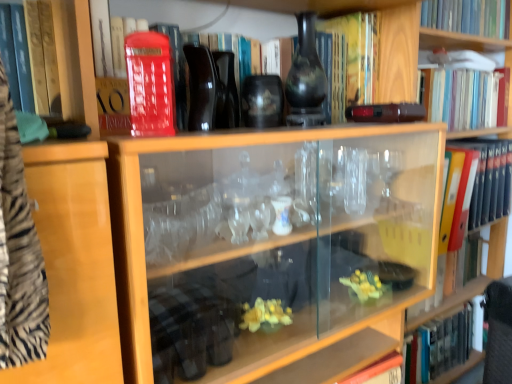
Question: From a real-world perspective, is matte red book at upper center, acting as the 4th book starting from the top, below matte red phone box at upper left?

Choices:
 (A) yes
 (B) no

Answer: (B)

Question: Is matte red book at upper center, acting as the 4th book starting from the top, not within matte red phone box at upper left?

Choices:
 (A) yes
 (B) no

Answer: (A)

Question: Is matte red book at upper center, acting as the 4th book starting from the top, to the right of matte red phone box at upper left from the viewer's perspective?

Choices:
 (A) no
 (B) yes

Answer: (B)

Question: Does matte red book at upper center, which is counted as the third book, starting from the bottom, have a smaller size compared to matte red phone box at upper left?

Choices:
 (A) no
 (B) yes

Answer: (A)

Question: Does matte red book at upper center, acting as the 4th book starting from the top, appear on the left side of matte red phone box at upper left?

Choices:
 (A) no
 (B) yes

Answer: (A)

Question: From the image's perspective, relative to matte black vase at upper center, is matte red book at upper center, which is counted as the third book, starting from the bottom, above or below?

Choices:
 (A) below
 (B) above

Answer: (A)

Question: Considering the positions of matte red book at upper center, acting as the 4th book starting from the top, and matte black vase at upper center in the image, is matte red book at upper center, acting as the 4th book starting from the top, bigger or smaller than matte black vase at upper center?

Choices:
 (A) big
 (B) small

Answer: (A)

Question: From a real-world perspective, is matte red book at upper center, which is counted as the third book, starting from the bottom, above or below matte black vase at upper center?

Choices:
 (A) above
 (B) below

Answer: (B)

Question: Looking at their shapes, would you say matte red book at upper center, acting as the 4th book starting from the top, is wider or thinner than matte black vase at upper center?

Choices:
 (A) thin
 (B) wide

Answer: (B)

Question: Is hardcover book at lower right, which is the sixth book from top to bottom, inside or outside of hardcover book at upper right, acting as the fifth book starting from the bottom?

Choices:
 (A) inside
 (B) outside

Answer: (B)

Question: Considering the positions of hardcover book at lower right, placed as the first book when sorted from bottom to top, and hardcover book at upper right, acting as the fifth book starting from the bottom, in the image, is hardcover book at lower right, placed as the first book when sorted from bottom to top, taller or shorter than hardcover book at upper right, acting as the fifth book starting from the bottom,?

Choices:
 (A) tall
 (B) short

Answer: (A)

Question: In the image, is hardcover book at lower right, which is the sixth book from top to bottom, on the left side or the right side of hardcover book at upper right, acting as the fifth book starting from the bottom?

Choices:
 (A) left
 (B) right

Answer: (B)

Question: From the image's perspective, is hardcover book at lower right, placed as the first book when sorted from bottom to top, above or below hardcover book at upper right, acting as the fifth book starting from the bottom?

Choices:
 (A) above
 (B) below

Answer: (B)

Question: Considering the positions of wooden bookshelf at upper right and matte black vase at upper center in the image, is wooden bookshelf at upper right wider or thinner than matte black vase at upper center?

Choices:
 (A) wide
 (B) thin

Answer: (A)

Question: Relative to matte black vase at upper center, is wooden bookshelf at upper right in front or behind?

Choices:
 (A) front
 (B) behind

Answer: (B)